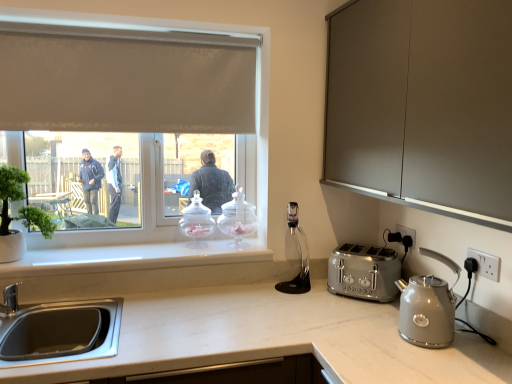
Question: Should I look upward or downward to see white fabric window at upper left?

Choices:
 (A) down
 (B) up

Answer: (B)

Question: Which direction should I rotate to look at clear glass jar at window, placed as the 2th kitchen appliance when sorted from left to right?

Choices:
 (A) right
 (B) left

Answer: (B)

Question: Considering the relative positions of white plastic electric outlet at right, which is the second electric outlet in left-to-right order, and matte gray cabinet at upper right in the image provided, is white plastic electric outlet at right, which is the second electric outlet in left-to-right order, to the right of matte gray cabinet at upper right from the viewer's perspective?

Choices:
 (A) yes
 (B) no

Answer: (A)

Question: From the image's perspective, is white plastic electric outlet at right, which is the second electric outlet in left-to-right order, under matte gray cabinet at upper right?

Choices:
 (A) yes
 (B) no

Answer: (A)

Question: Is white plastic electric outlet at right, which is the second electric outlet in left-to-right order, far from matte gray cabinet at upper right?

Choices:
 (A) no
 (B) yes

Answer: (A)

Question: Does white plastic electric outlet at right, positioned as the 1th electric outlet in right-to-left order, turn towards matte gray cabinet at upper right?

Choices:
 (A) yes
 (B) no

Answer: (B)

Question: Is white plastic electric outlet at right, positioned as the 1th electric outlet in right-to-left order, in front of matte gray cabinet at upper right?

Choices:
 (A) yes
 (B) no

Answer: (B)

Question: From a real-world perspective, is white plastic electric outlet at right, marked as the second electric outlet in a back-to-front arrangement, physically above matte gray cabinet at upper right?

Choices:
 (A) yes
 (B) no

Answer: (B)

Question: Can you confirm if matte silver kettle at right, placed as the 3th kitchen appliance when sorted from back to front, is taller than white plastic electric outlet at right, marked as the second electric outlet in a back-to-front arrangement?

Choices:
 (A) no
 (B) yes

Answer: (B)

Question: From the image's perspective, is matte silver kettle at right, the 1th kitchen appliance viewed from the front, located above white plastic electric outlet at right, which is the 1th electric outlet from front to back?

Choices:
 (A) yes
 (B) no

Answer: (B)

Question: Is matte silver kettle at right, placed as the 3th kitchen appliance when sorted from back to front, completely or partially outside of white plastic electric outlet at right, positioned as the 1th electric outlet in right-to-left order?

Choices:
 (A) yes
 (B) no

Answer: (A)

Question: Considering the relative positions of matte silver kettle at right, acting as the first kitchen appliance starting from the right, and white plastic electric outlet at right, which is the second electric outlet in left-to-right order, in the image provided, is matte silver kettle at right, acting as the first kitchen appliance starting from the right, to the left of white plastic electric outlet at right, which is the second electric outlet in left-to-right order, from the viewer's perspective?

Choices:
 (A) no
 (B) yes

Answer: (B)

Question: Is matte silver kettle at right, acting as the first kitchen appliance starting from the right, closer to the viewer compared to white plastic electric outlet at right, marked as the second electric outlet in a back-to-front arrangement?

Choices:
 (A) yes
 (B) no

Answer: (A)

Question: Is matte silver kettle at right, placed as the 3th kitchen appliance when sorted from back to front, positioned far away from white plastic electric outlet at right, which is the 1th electric outlet from front to back?

Choices:
 (A) yes
 (B) no

Answer: (B)

Question: From a real-world perspective, is clear glass jar at window, positioned as the 1th kitchen appliance in back-to-front order, over green matte plant at left?

Choices:
 (A) no
 (B) yes

Answer: (A)